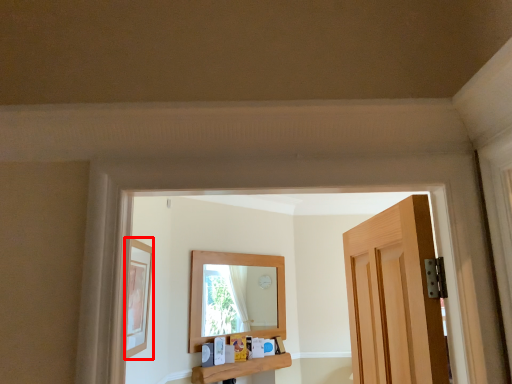
Question: In this image, where is picture frame (annotated by the red box) located relative to window sill?

Choices:
 (A) right
 (B) left

Answer: (B)